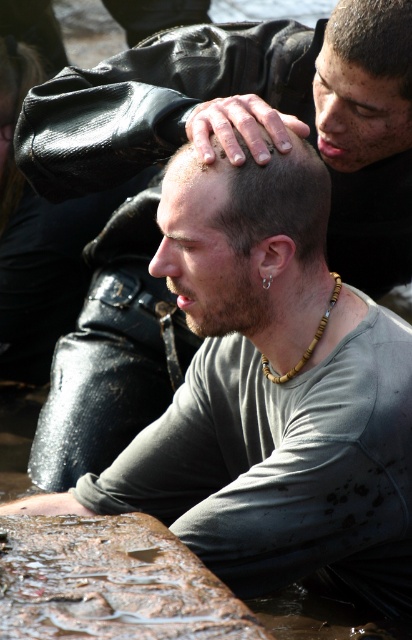
Question: Considering the relative positions of shiny black hair at center and dark brown hair at upper center in the image provided, where is shiny black hair at center located with respect to dark brown hair at upper center?

Choices:
 (A) above
 (B) below

Answer: (B)

Question: Is shiny black hair at center smaller than dark brown hair at upper center?

Choices:
 (A) no
 (B) yes

Answer: (A)

Question: Can you confirm if shiny black hair at center is bigger than dark brown hair at upper center?

Choices:
 (A) yes
 (B) no

Answer: (A)

Question: Which object appears farthest from the camera in this image?

Choices:
 (A) dark brown hair at upper center
 (B) shiny black hair at center

Answer: (A)

Question: Which point is closer to the camera?

Choices:
 (A) dark brown hair at upper center
 (B) shiny black hair at center

Answer: (B)